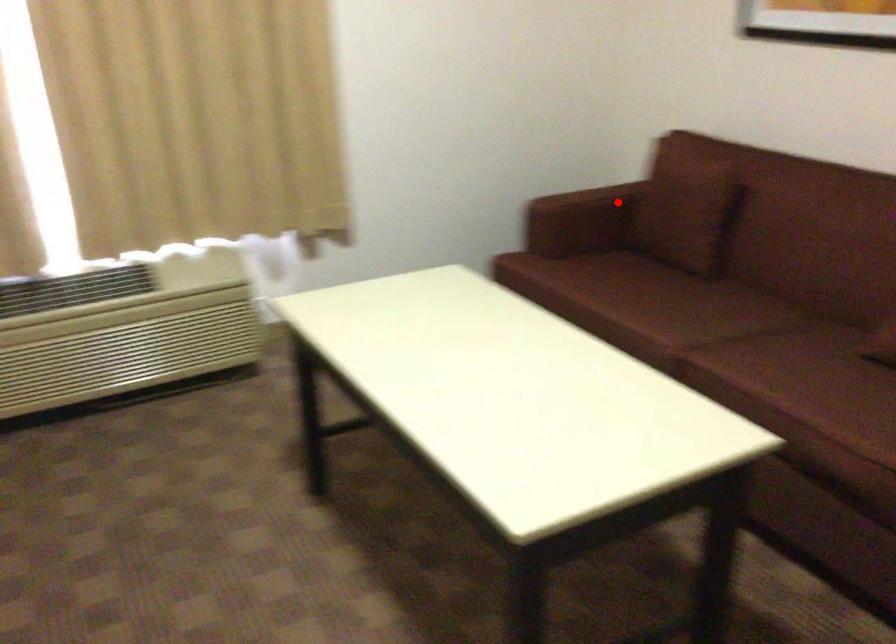
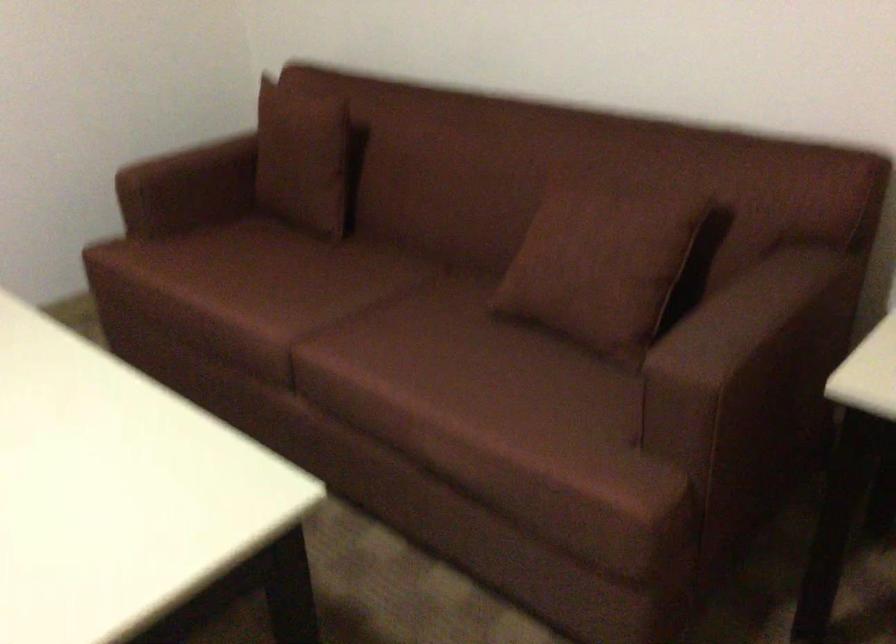
Locate, in the second image, the point that corresponds to the highlighted location in the first image.

(246, 165)